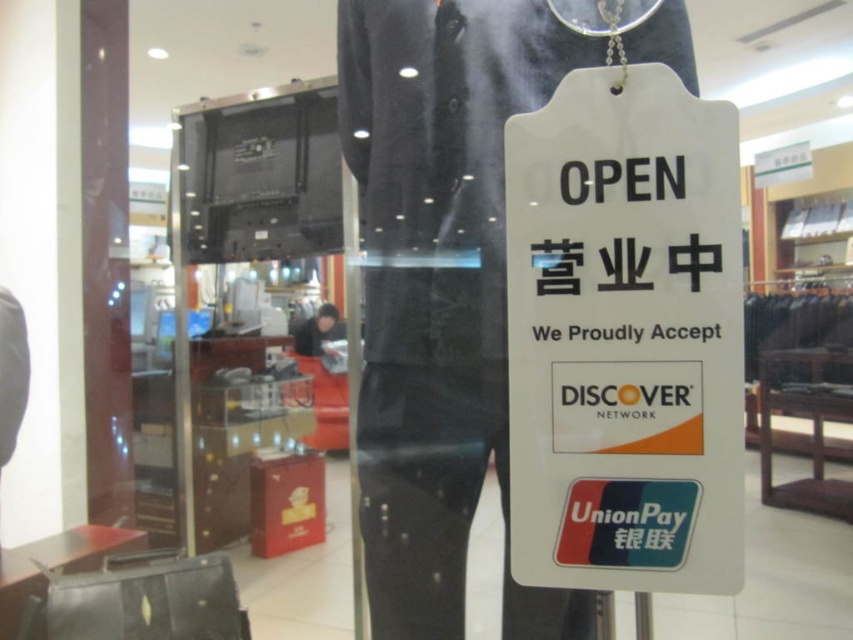
In the scene shown: You are a customer entering the store and see the white paper sign at center and the black fabric mannequin at center. Which object is located to the right of the other?

The white paper sign at center is positioned on the right side of black fabric mannequin at center.

You are a customer standing at the entrance of the store and want to read the white paper sign at center. Can you reach it without moving closer than 60 centimeters?

The white paper sign at center is 61.26 centimeters from the camera, so you cannot reach it without moving closer than 60 centimeters.

You are a customer entering the store and see the white paper sign at center and the black fabric mannequin at center. Which object is physically closer to you?

The white paper sign at center is closer to you since it has a smaller size compared to the black fabric mannequin at center.